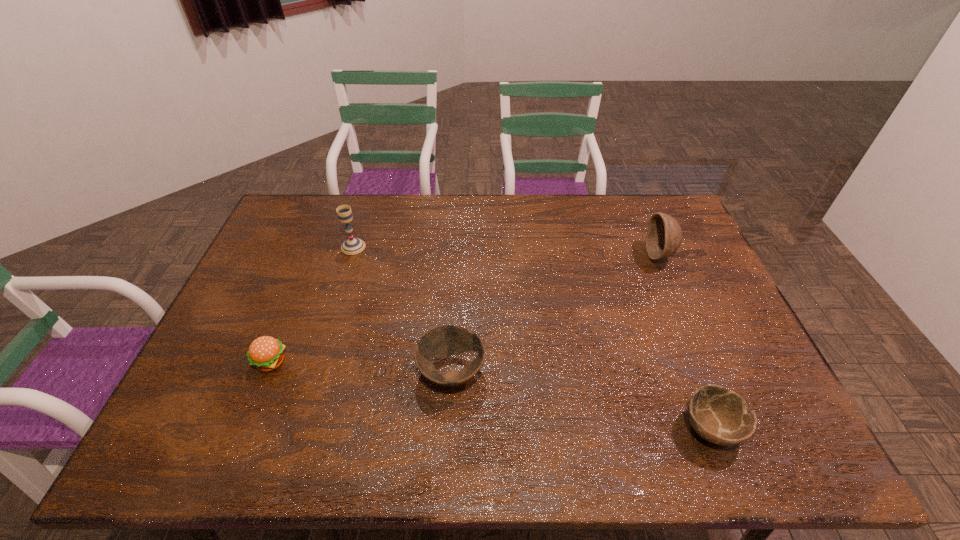
Find the location of `the tallest bowl`. the tallest bowl is located at coordinates (664, 235).

Identify the location of chalice. The width and height of the screenshot is (960, 540). coord(351,246).

Where is `the leftmost bowl`? Image resolution: width=960 pixels, height=540 pixels. the leftmost bowl is located at coordinates (445, 340).

Locate an element on the screen. Image resolution: width=960 pixels, height=540 pixels. hamburger is located at coordinates [266, 353].

This screenshot has width=960, height=540. I want to click on the shortest bowl, so click(720, 416).

Image resolution: width=960 pixels, height=540 pixels. I want to click on free space located 0.250m on the back of the farthest bowl, so click(x=635, y=198).

At what (x,y) coordinates should I click in order to perform the action: click on vacant space located 0.070m on the front of the second object from left to right. Please return your answer as a coordinate pair (x, y). Looking at the image, I should click on (347, 269).

This screenshot has width=960, height=540. Find the location of `free space located 0.210m on the right of the third object from right to left`. free space located 0.210m on the right of the third object from right to left is located at coordinates (566, 372).

The height and width of the screenshot is (540, 960). I want to click on vacant space located on the back of the leftmost object, so click(x=299, y=292).

This screenshot has height=540, width=960. Identify the location of vacant area situated on the back of the shortest bowl. [x=683, y=353].